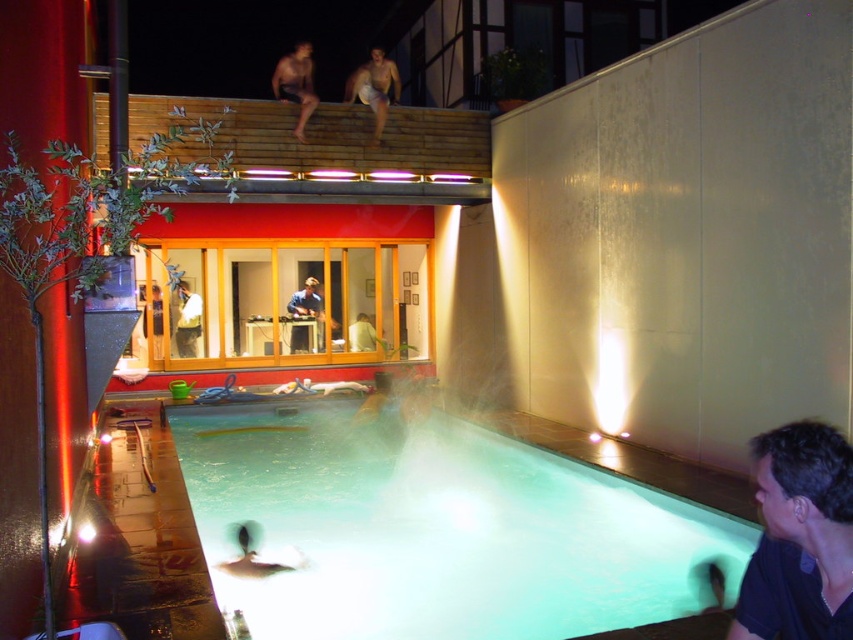
Is clear acrylic pool at lower center to the right of dark blue shirt at lower right from the viewer's perspective?

No, clear acrylic pool at lower center is not to the right of dark blue shirt at lower right.

Is point (628, 573) positioned behind point (809, 605)?

Yes, it is behind point (809, 605).

Does point (369, 612) come in front of point (809, 497)?

No, it is behind (809, 497).

Find the location of a particular element. clear acrylic pool at lower center is located at coordinates (436, 529).

Who is lower down, skinny man at upper center or blue fabric shirt at center?

blue fabric shirt at center

Is skinny man at upper center taller than blue fabric shirt at center?

Yes.

Measure the distance between skinny man at upper center and camera.

A distance of 30.08 feet exists between skinny man at upper center and camera.

Identify the location of skinny man at upper center. The image size is (853, 640). (296, 83).

Who is shorter, clear acrylic pool at lower center or blue fabric shirt at center?

clear acrylic pool at lower center is shorter.

From the picture: Between clear acrylic pool at lower center and blue fabric shirt at center, which one has more height?

Standing taller between the two is blue fabric shirt at center.

Who is more forward, (467, 448) or (312, 316)?

Point (467, 448)

Image resolution: width=853 pixels, height=640 pixels. I want to click on clear acrylic pool at lower center, so click(436, 529).